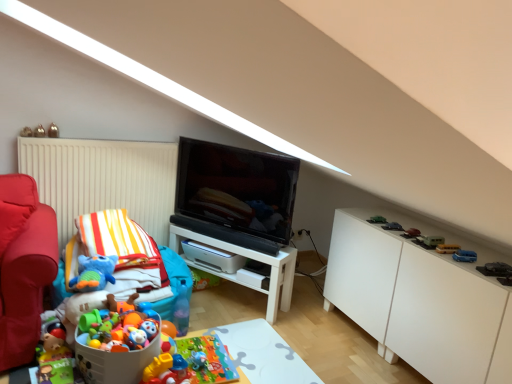
Locate an element on the screen. The image size is (512, 384). blank space above translucent plastic blocks at center, acting as the 1th toy starting from the bottom (from a real-world perspective) is located at coordinates (159, 355).